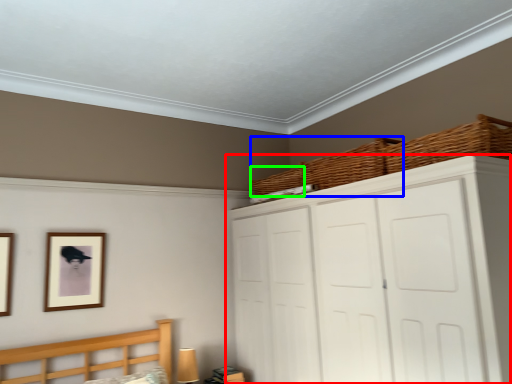
Question: Which object is the closest to the cupboard (highlighted by a red box)? Choose among these: basket (highlighted by a blue box) or basket (highlighted by a green box).

Choices:
 (A) basket
 (B) basket

Answer: (A)